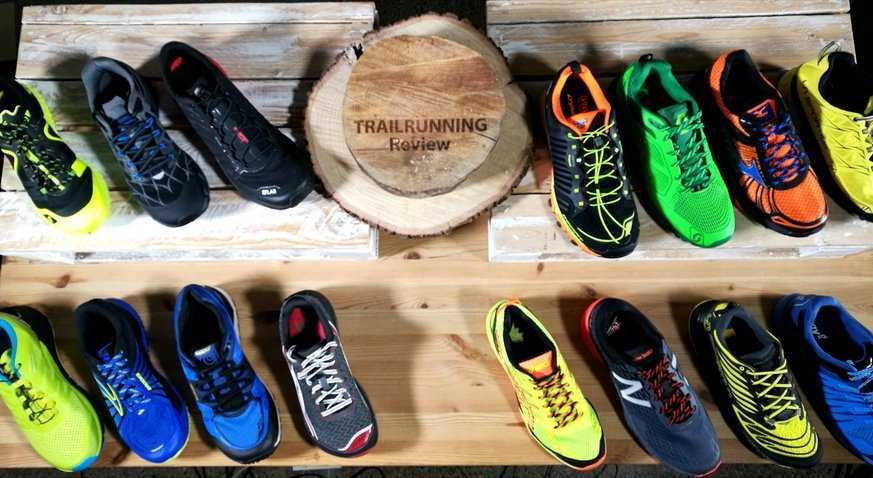
You are a GUI agent. You are given a task and a screenshot of the screen. Output one action in this format:
    pyautogui.click(x=<x>, y=<y>)
    Task: Click on the shoes on the bottom row
    
    Given the screenshot: What is the action you would take?
    [72, 426], [134, 417], [220, 396], [306, 397], [553, 391], [643, 391], [747, 383], [836, 373]